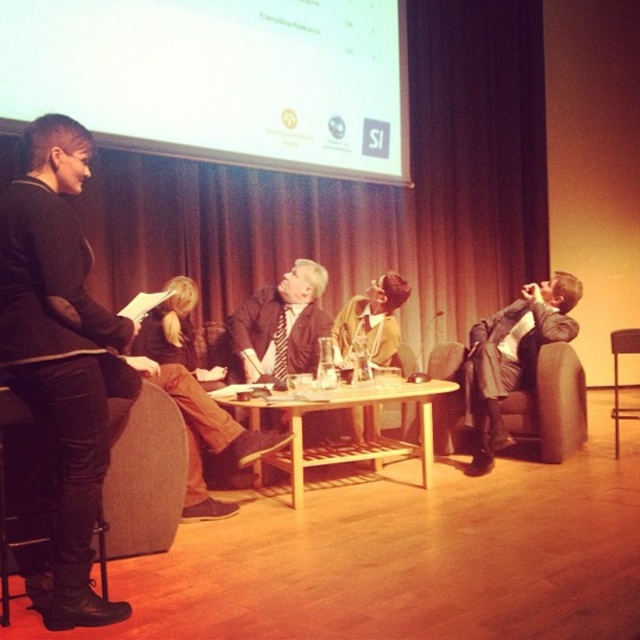
Which is behind, point (81, 156) or point (625, 419)?

Positioned behind is point (625, 419).

Locate an element on the screen. black leather pants at left is located at coordinates (61, 356).

Is point (48, 596) farther from camera compared to point (616, 428)?

No.

The height and width of the screenshot is (640, 640). I want to click on black leather pants at left, so click(x=61, y=356).

Is point (310, 310) behind point (337, 340)?

No, (310, 310) is in front of (337, 340).

Based on the photo, can you confirm if matte black suit at center is positioned below light brown leather jacket at center?

Actually, matte black suit at center is above light brown leather jacket at center.

Who is more forward, (275,369) or (352,307)?

Positioned in front is point (275,369).

Locate an element on the screen. The width and height of the screenshot is (640, 640). matte black suit at center is located at coordinates (282, 324).

Does black leather pants at left have a greater width compared to brown leather jacket at center?

No, black leather pants at left is not wider than brown leather jacket at center.

Does black leather pants at left appear over brown leather jacket at center?

Correct, black leather pants at left is located above brown leather jacket at center.

Where is `black leather pants at left`? The image size is (640, 640). black leather pants at left is located at coordinates pos(61,356).